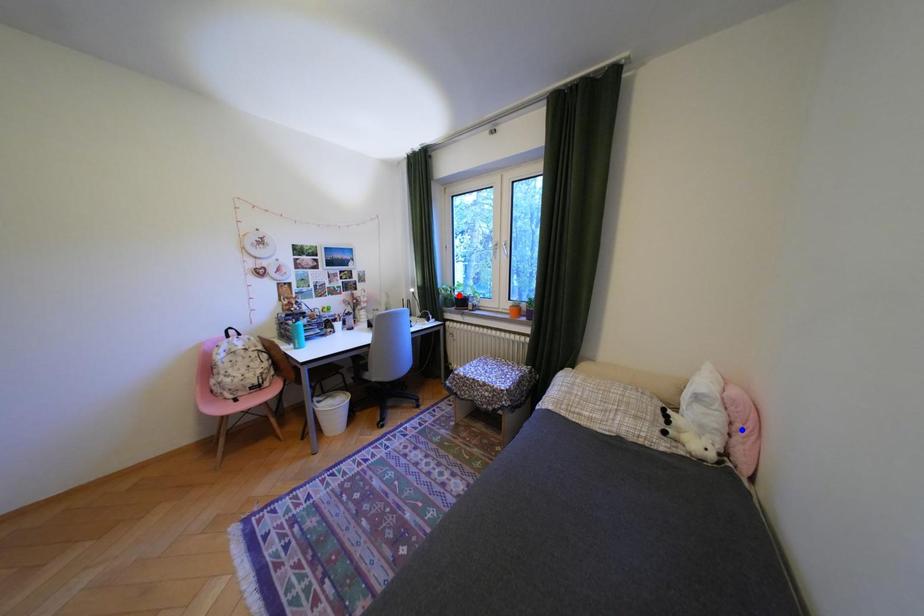
Question: In the image, two points are highlighted. Which point is nearer to the camera? Reply with the corresponding letter.

Choices:
 (A) blue point
 (B) red point

Answer: (A)